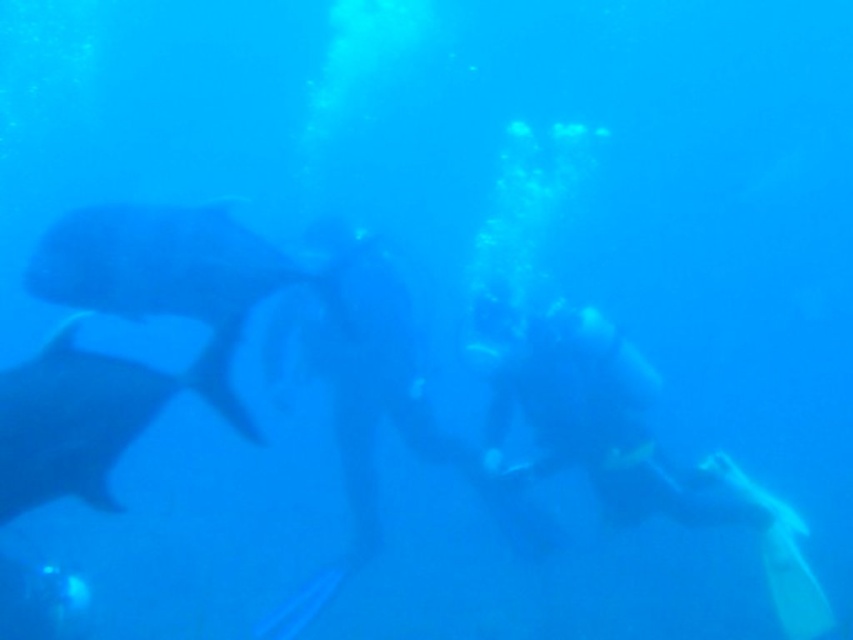
Question: Based on their relative distances, which object is farther from the gray matte whale at left?

Choices:
 (A) yellow rubber fins at right
 (B) smooth gray fish at left

Answer: (A)

Question: Which of the following is the farthest from the observer?

Choices:
 (A) (216, 291)
 (B) (527, 312)

Answer: (B)

Question: Among these points, which one is nearest to the camera?

Choices:
 (A) (548, 385)
 (B) (120, 236)
 (C) (57, 458)

Answer: (C)

Question: Considering the relative positions of smooth gray fish at left and gray matte whale at left in the image provided, where is smooth gray fish at left located with respect to gray matte whale at left?

Choices:
 (A) above
 (B) below

Answer: (A)

Question: Does yellow rubber fins at right appear over gray matte whale at left?

Choices:
 (A) no
 (B) yes

Answer: (A)

Question: In this image, where is yellow rubber fins at right located relative to gray matte whale at left?

Choices:
 (A) above
 (B) below

Answer: (B)